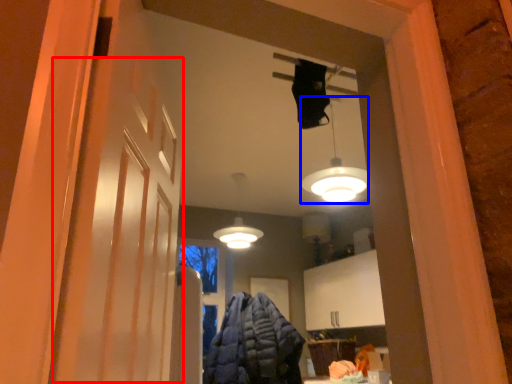
Question: Which of the following is the farthest to the observer, barn door (highlighted by a red box) or lamp (highlighted by a blue box)?

Choices:
 (A) barn door
 (B) lamp

Answer: (B)